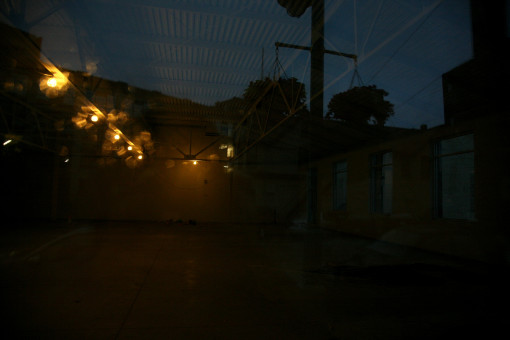
You are a GUI agent. You are given a task and a screenshot of the screen. Output one action in this format:
    pyautogui.click(x=<x>, y=<y>)
    Task: Click on the lights
    Image resolution: width=510 pixels, height=340 pixels.
    Given the screenshot: What is the action you would take?
    pyautogui.click(x=94, y=119), pyautogui.click(x=53, y=82), pyautogui.click(x=117, y=136), pyautogui.click(x=130, y=148), pyautogui.click(x=139, y=156)